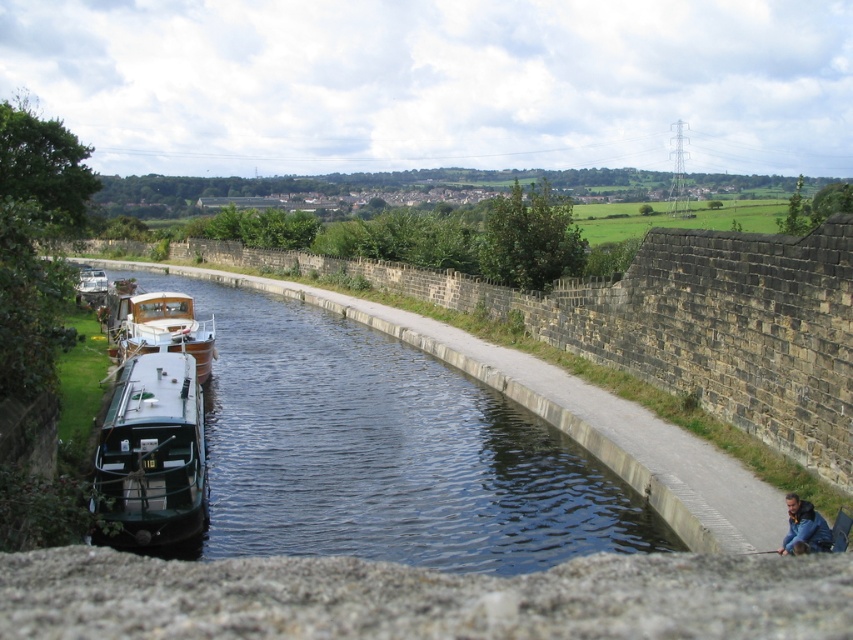
Consider the image. You are standing on the left side of the canal and want to reach the blue denim jacket at lower right. Which direction should you move relative to the wooden polished boat at center?

You should move to the right of the wooden polished boat at center to reach the blue denim jacket at lower right since the wooden polished boat at center is positioned on the left side of the blue denim jacket at lower right.

You are standing at the edge of the canal and see the wooden polished boat at center and the blue denim jacket at lower right. Which object is closer to you?

The wooden polished boat at center is closer to you because the blue denim jacket at lower right is behind it, meaning the boat is in front.

You are standing at the edge of the canal and want to reach a specific point marked at coordinates point (610, 544). If your maximum reach is 12 meters, can you touch this point without moving closer?

The point (610, 544) is 12.79 meters away from the viewer. Since your maximum reach is 12 meters, you cannot touch this point without moving closer.